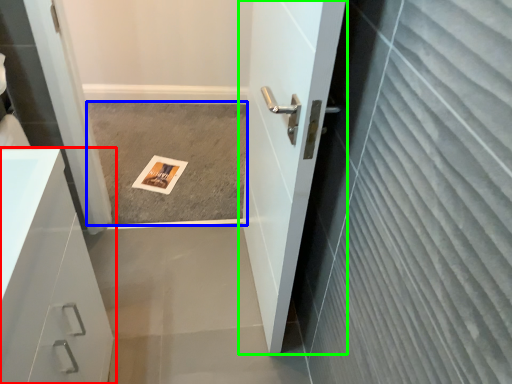
Question: Considering the real-world distances, which object is farthest from bathroom cabinet (highlighted by a red box)? concrete (highlighted by a blue box) or door (highlighted by a green box)?

Choices:
 (A) concrete
 (B) door

Answer: (A)